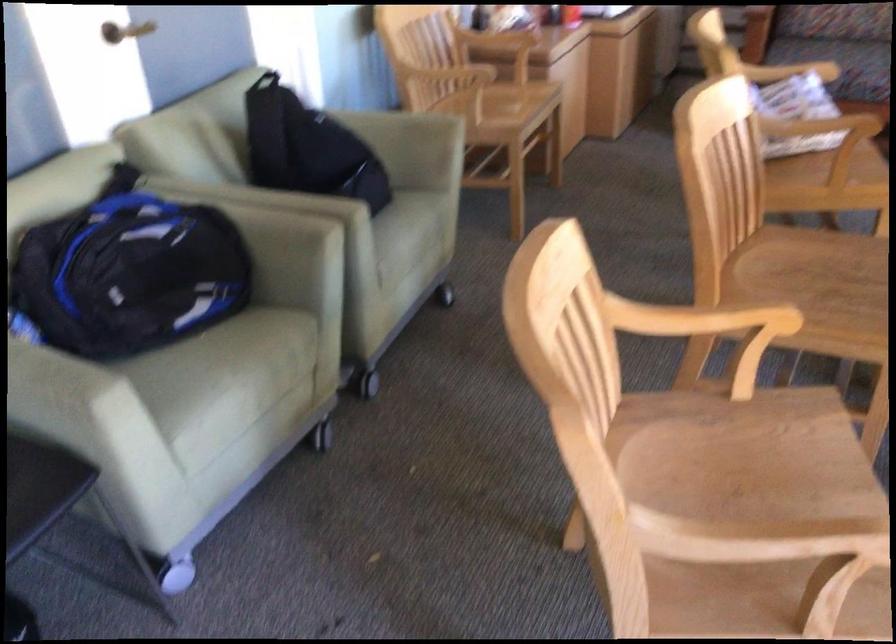
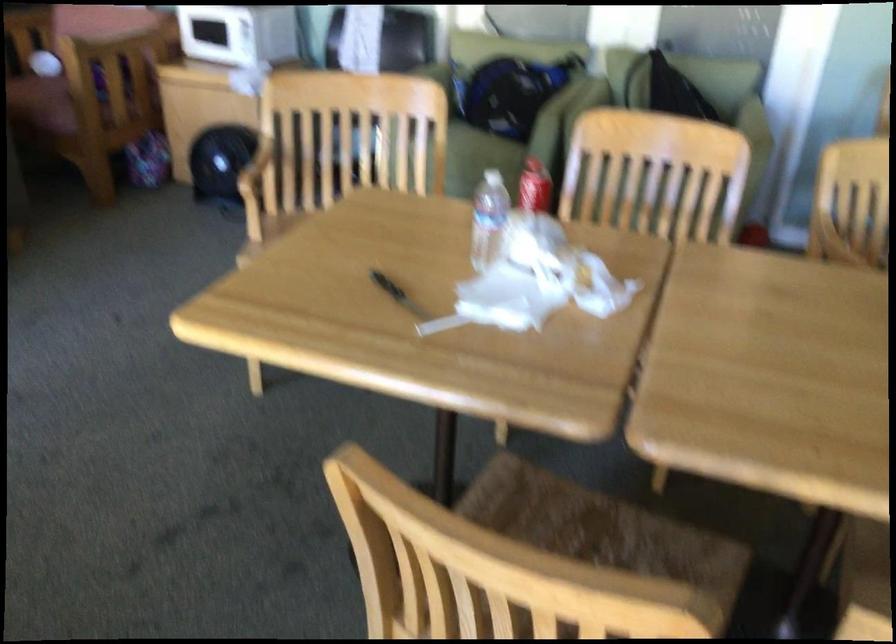
Question: I am providing you with two images of the same scene from different viewpoints. After the viewpoint changes to image2, which objects are now occluded?

Choices:
 (A) chair armrest
 (B) brown digital clock
 (C) plastic water bottle
 (D) chair sitting surface

Answer: (D)